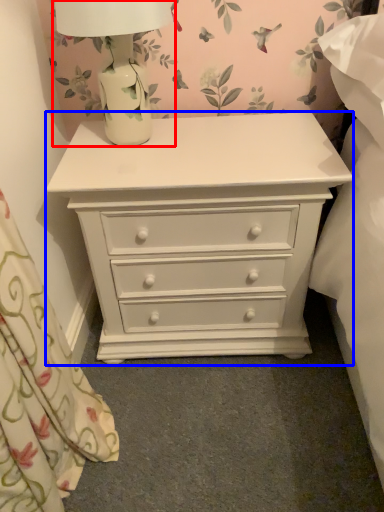
Question: Among these objects, which one is nearest to the camera, table lamp (highlighted by a red box) or chest of drawers (highlighted by a blue box)?

Choices:
 (A) table lamp
 (B) chest of drawers

Answer: (A)